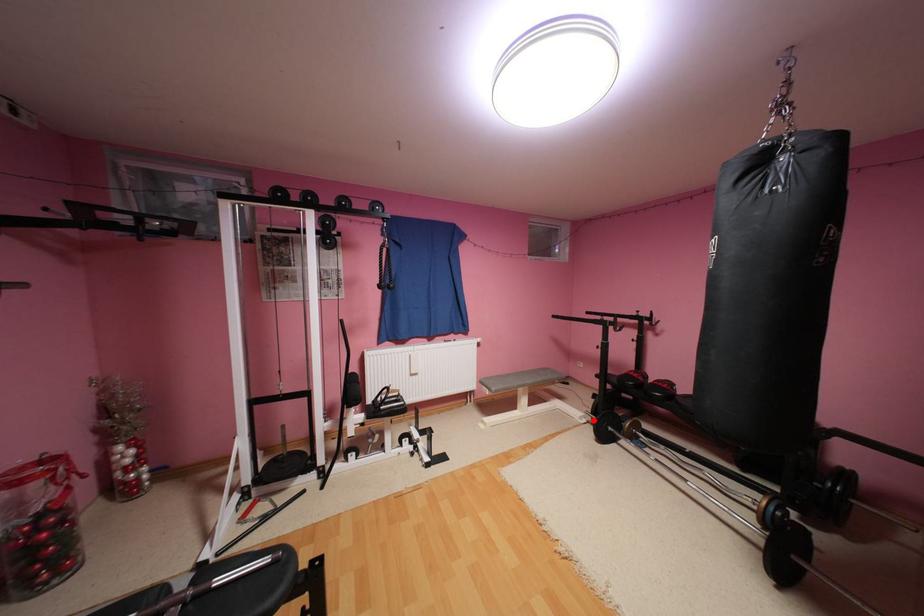
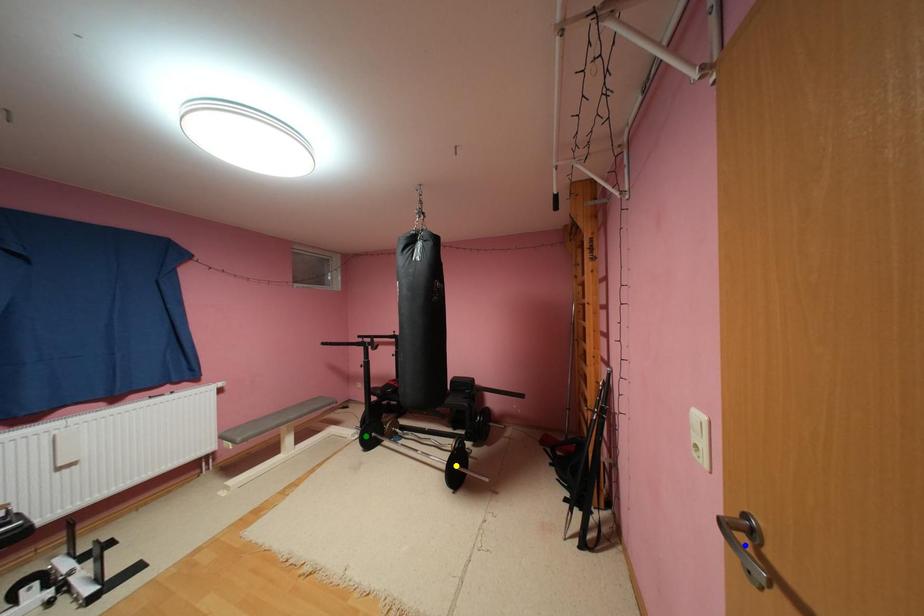
Question: I am providing you with two images of the same scene from different viewpoints. A red point is marked on the first image. You are given multiple points on the second image. Which mark in image 2 goes with the point in image 1?

Choices:
 (A) yellow point
 (B) blue point
 (C) green point

Answer: (C)